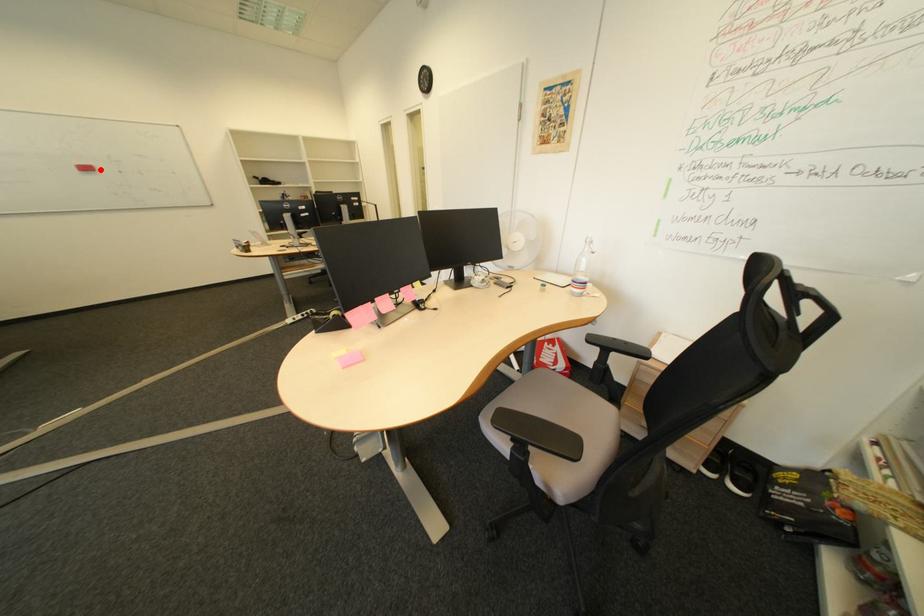
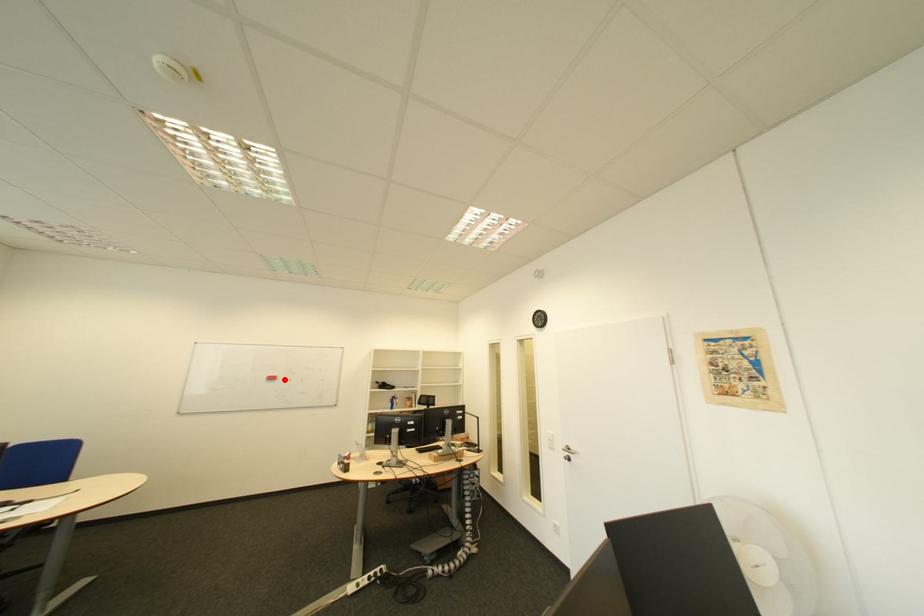
I am providing you with two images of the same scene from different viewpoints. A red point is marked on the first image and another point is marked on the second image. Is the red point in image1 aligned with the point shown in image2?

Yes